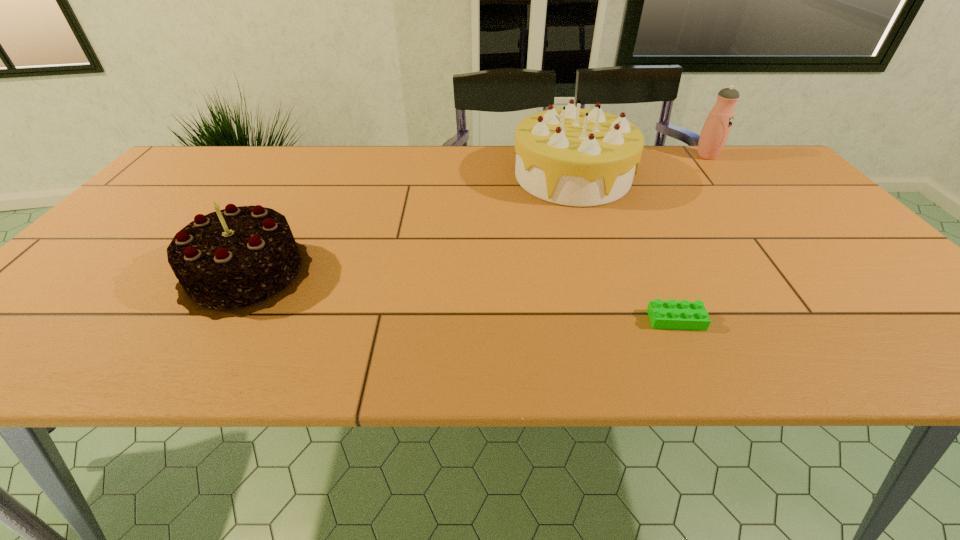
At what (x,y) coordinates should I click in order to perform the action: click on the closest object relative to the right birthday cake. Please return your answer as a coordinate pair (x, y). This screenshot has width=960, height=540. Looking at the image, I should click on (716, 129).